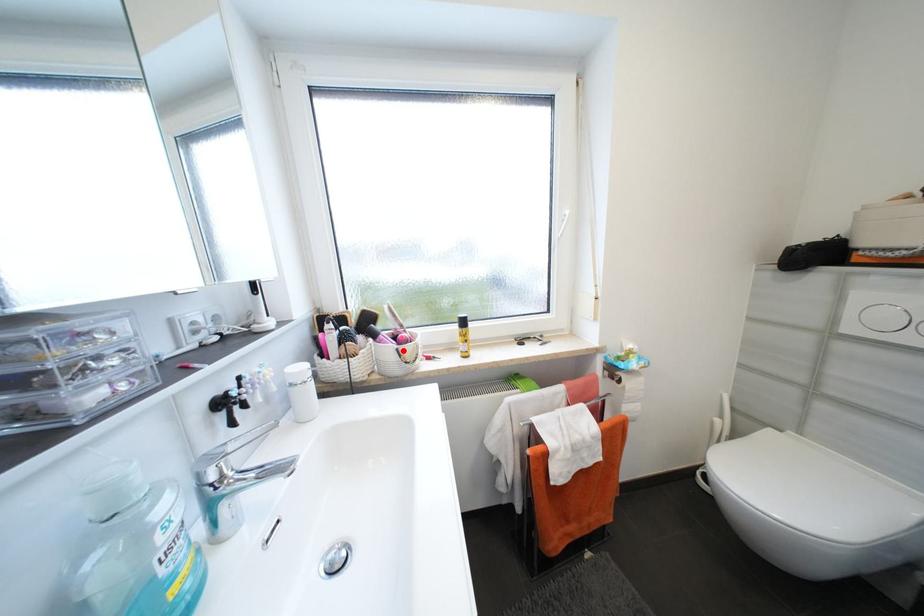
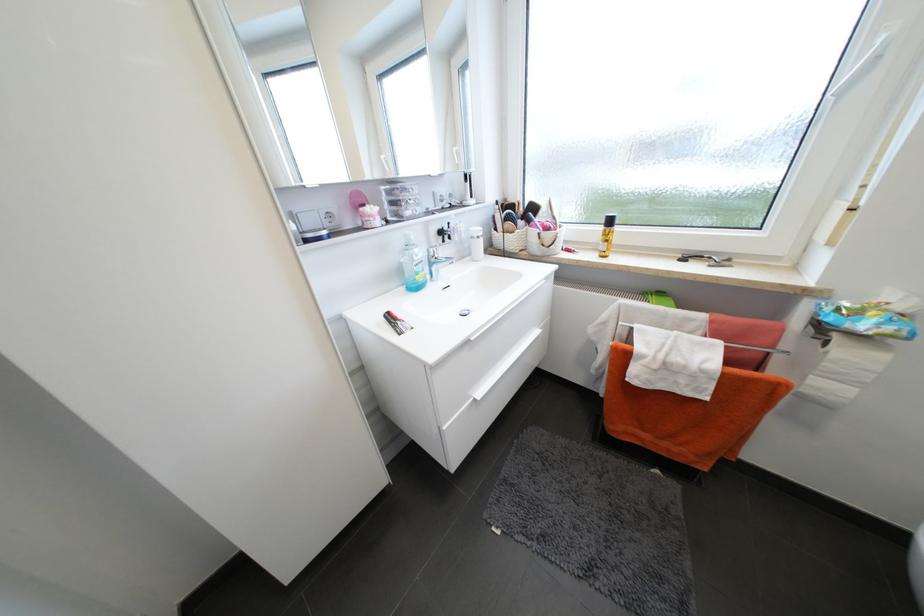
In the second image, find the point that corresponds to the highlighted location in the first image.

(544, 235)